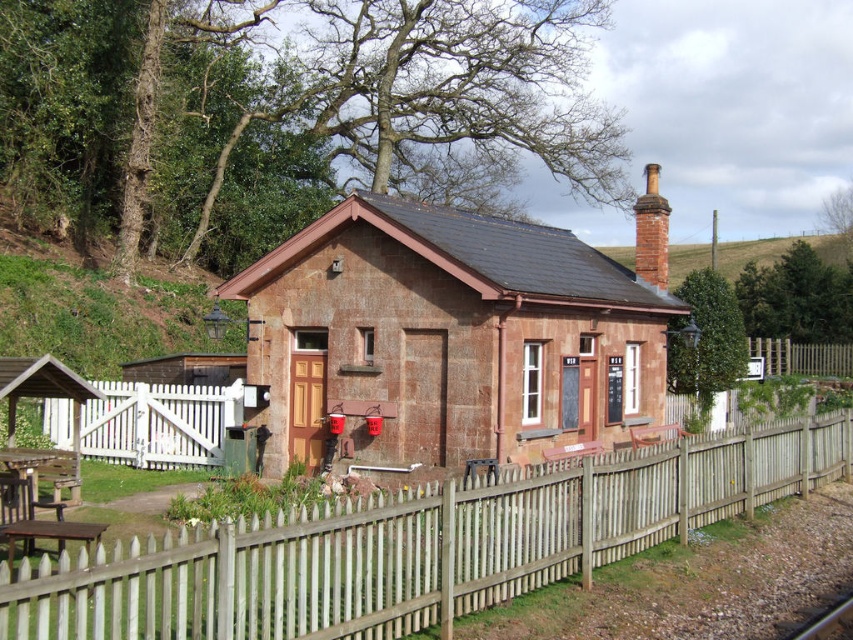
Question: Can you confirm if brown wooden fence at right is bigger than gray metallic train track at lower right?

Choices:
 (A) no
 (B) yes

Answer: (B)

Question: Which point is farther to the camera?

Choices:
 (A) (840, 611)
 (B) (334, 419)
 (C) (825, 356)

Answer: (C)

Question: From the image, what is the correct spatial relationship of wooden picket fence at center in relation to white wooden fence at lower left?

Choices:
 (A) below
 (B) above

Answer: (A)

Question: Is rustic stone hut at center in front of red brick chimney at upper right?

Choices:
 (A) yes
 (B) no

Answer: (A)

Question: Which point is closer to the camera?

Choices:
 (A) (496, 317)
 (B) (807, 627)

Answer: (B)

Question: Which point is closer to the camera?

Choices:
 (A) (172, 589)
 (B) (199, 417)

Answer: (A)